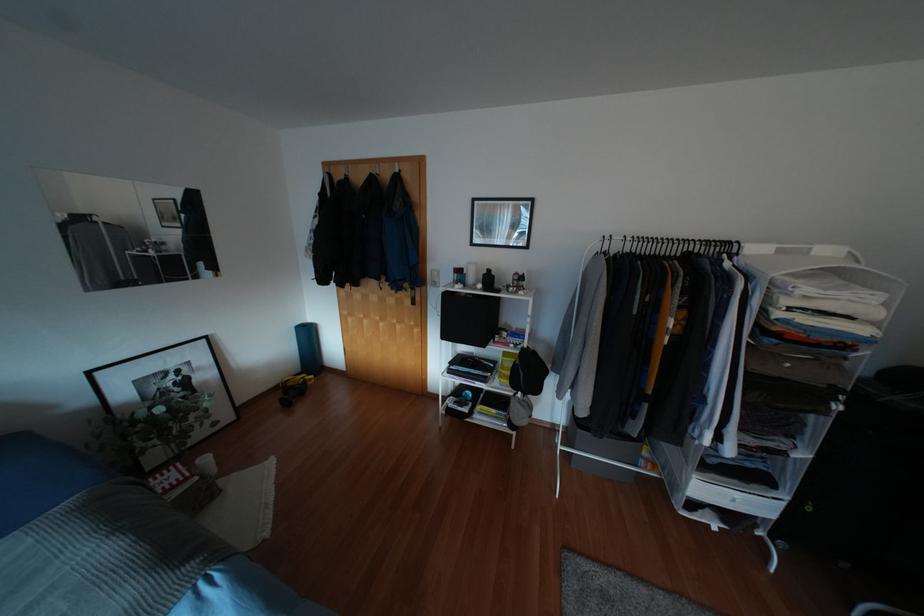
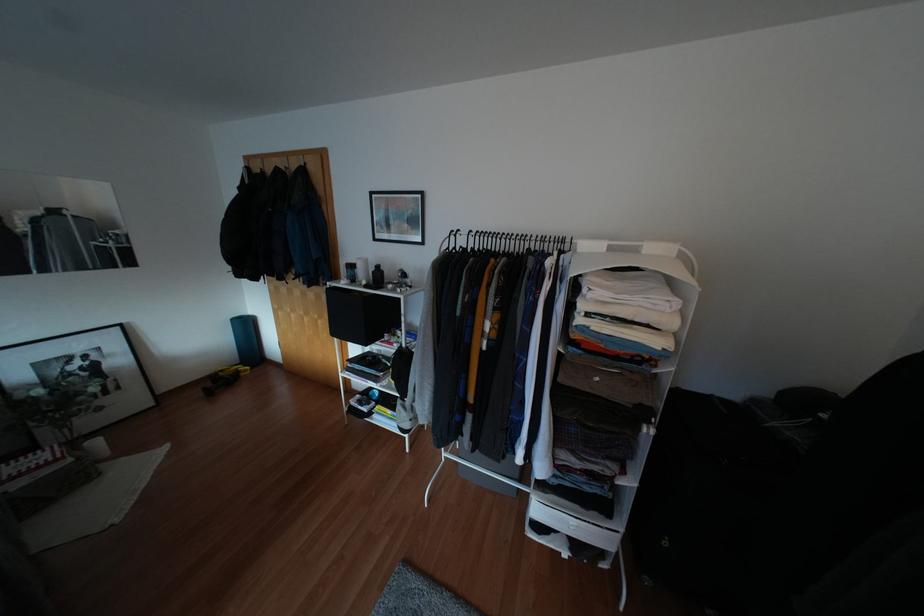
The point at (707, 241) is marked in the first image. Where is the corresponding point in the second image?

(542, 238)